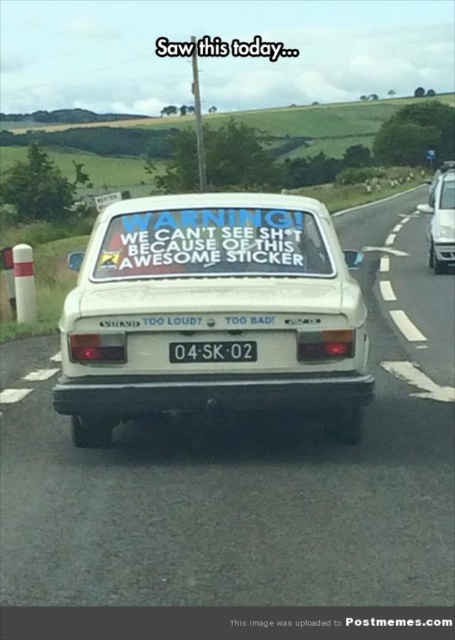
Question: From the image, what is the correct spatial relationship of white matte sticker at center in relation to black plastic license plate at center?

Choices:
 (A) above
 (B) below

Answer: (A)

Question: From the image, what is the correct spatial relationship of white plastic car at center in relation to black plastic license plate at center?

Choices:
 (A) right
 (B) left

Answer: (A)

Question: Considering the real-world distances, which object is farthest from the white matte car at right?

Choices:
 (A) black plastic license plate at center
 (B) white plastic car at center

Answer: (A)

Question: Which object is positioned closest to the white plastic car at center?

Choices:
 (A) black plastic license plate at center
 (B) white matte sticker at center
 (C) white matte car at right

Answer: (A)

Question: Among these points, which one is farthest from the camera?

Choices:
 (A) (223, 362)
 (B) (453, 212)
 (C) (66, 557)
 (D) (205, 326)

Answer: (B)

Question: Can you confirm if white plastic car at center is positioned to the left of white matte car at right?

Choices:
 (A) yes
 (B) no

Answer: (A)